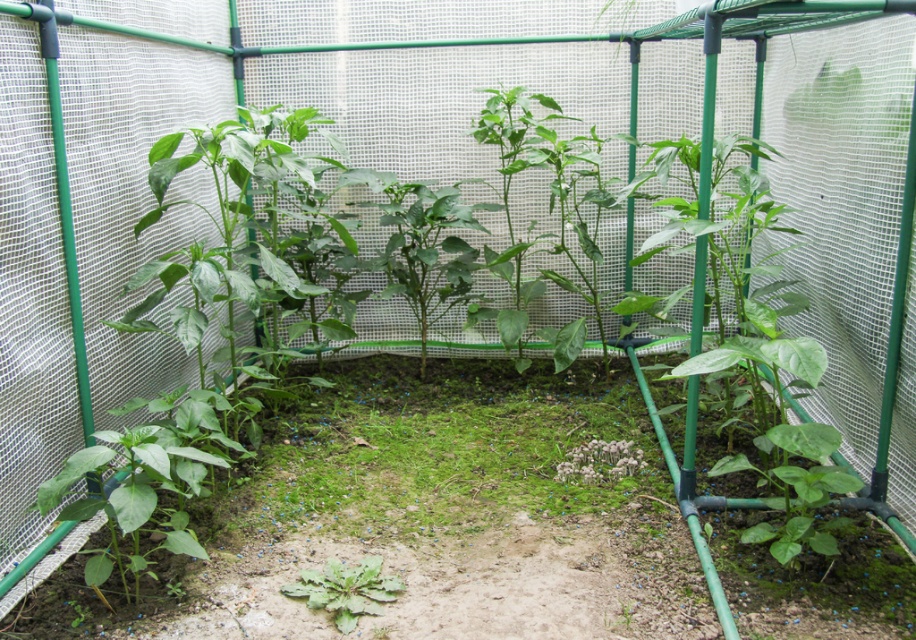
Question: Which of the following is the farthest from the observer?

Choices:
 (A) green mossy grass at center
 (B) green matte plant at center

Answer: (A)

Question: Is green mossy grass at center smaller than green matte plant at center?

Choices:
 (A) no
 (B) yes

Answer: (A)

Question: Which point is closer to the camera?

Choices:
 (A) (350, 570)
 (B) (532, 451)

Answer: (A)

Question: Can you confirm if green mossy grass at center is wider than green matte plant at center?

Choices:
 (A) yes
 (B) no

Answer: (A)

Question: Can you confirm if green mossy grass at center is thinner than green matte plant at center?

Choices:
 (A) no
 (B) yes

Answer: (A)